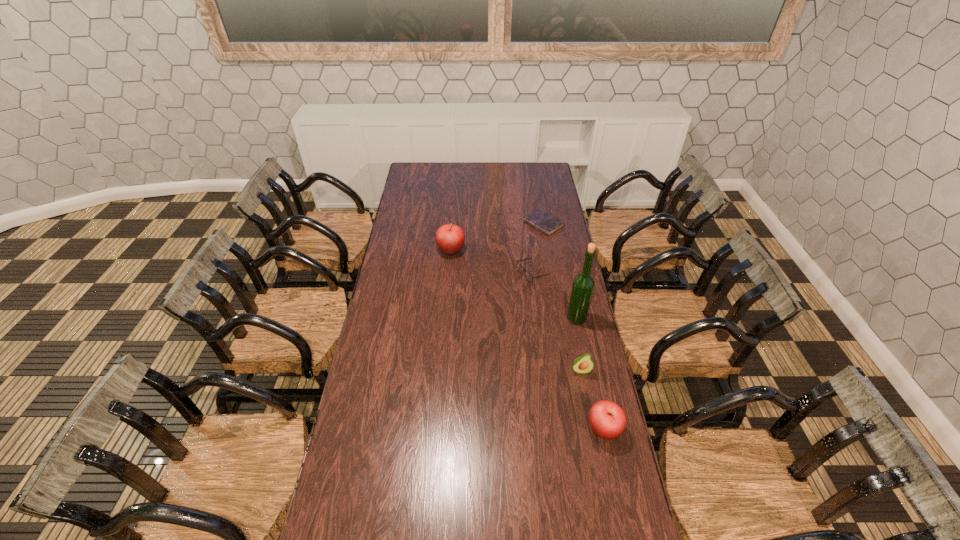
I want to click on vacant spot for a new apple to ensure equal spacing, so click(x=513, y=323).